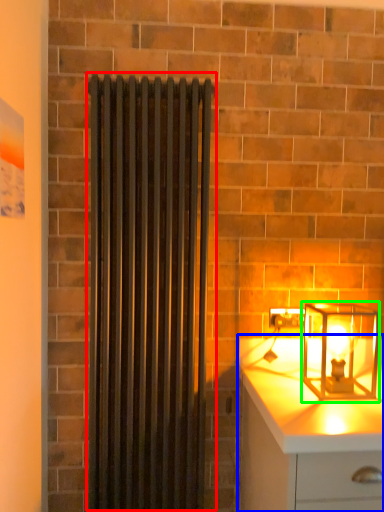
Question: Based on their relative distances, which object is nearer to shower curtain (highlighted by a red box)? Choose from chest of drawers (highlighted by a blue box) and lamp (highlighted by a green box).

Choices:
 (A) chest of drawers
 (B) lamp

Answer: (A)